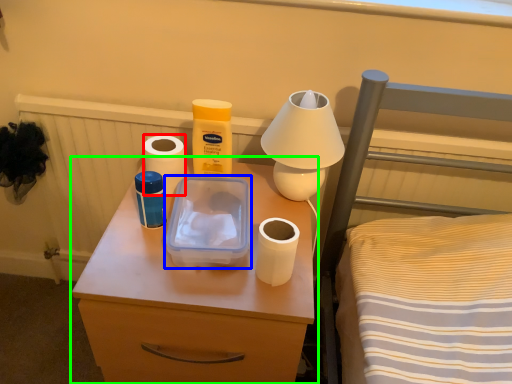
Question: Which object is the farthest from toilet paper (highlighted by a red box)? Choose among these: lunch box (highlighted by a blue box) or nightstand (highlighted by a green box).

Choices:
 (A) lunch box
 (B) nightstand

Answer: (B)